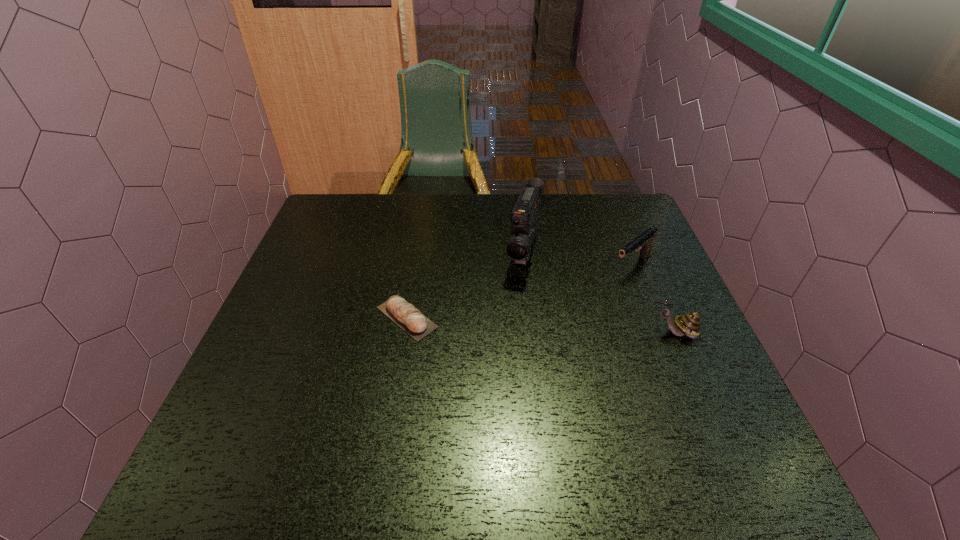
Locate an element on the screen. This screenshot has width=960, height=540. blank space at the near edge of the desktop is located at coordinates (489, 434).

Where is `vacant region at the left edge of the desktop`? Image resolution: width=960 pixels, height=540 pixels. vacant region at the left edge of the desktop is located at coordinates (273, 357).

You are a GUI agent. You are given a task and a screenshot of the screen. Output one action in this format:
    pyautogui.click(x=<x>, y=<y>)
    Task: Click on the vacant space at the right edge
    
    Given the screenshot: What is the action you would take?
    pyautogui.click(x=657, y=279)

In the image, there is a desktop. What are the coordinates of `vacant space at the far left corner` in the screenshot? It's located at (344, 207).

What are the coordinates of `free space at the near left corner` in the screenshot? It's located at (248, 420).

In the image, there is a desktop. Identify the location of blank space at the far right corner. The image size is (960, 540). tap(626, 220).

The image size is (960, 540). In order to click on blank space at the near right corner of the desktop in this screenshot , I will do `click(659, 414)`.

Locate an element on the screen. The image size is (960, 540). free space between the shortest object and the tallest object is located at coordinates (466, 285).

At what (x,y) coordinates should I click in order to perform the action: click on free space between the snail and the pistol. Please return your answer as a coordinate pair (x, y). The width and height of the screenshot is (960, 540). Looking at the image, I should click on (654, 300).

You are a GUI agent. You are given a task and a screenshot of the screen. Output one action in this format:
    pyautogui.click(x=<x>, y=<y>)
    Task: Click on the free space between the leftmost object and the pistol
    
    Given the screenshot: What is the action you would take?
    [519, 292]